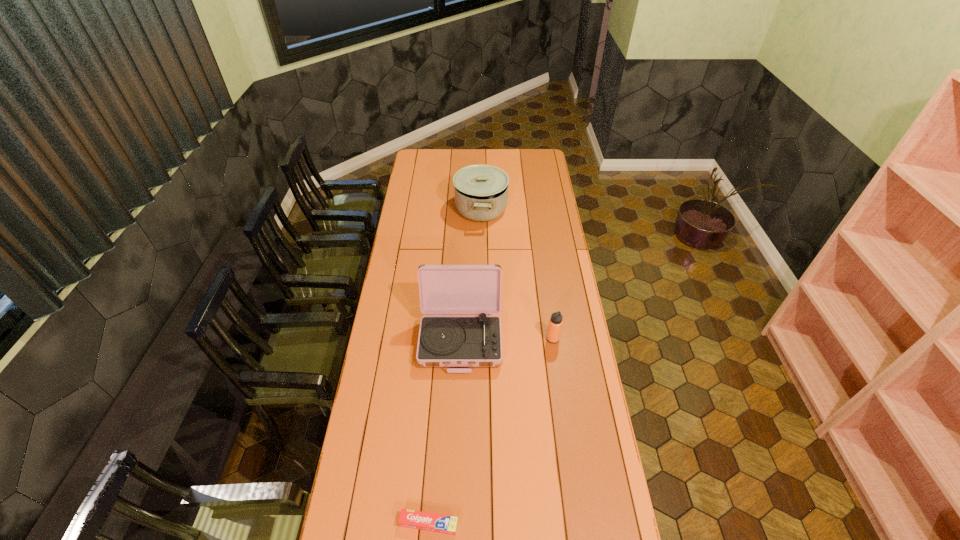
You are a GUI agent. You are given a task and a screenshot of the screen. Output one action in this format:
    pyautogui.click(x=<x>, y=<y>)
    Task: Click on the vacant space positioned on the right of the nearest object
    This screenshot has width=960, height=540.
    Given the screenshot: What is the action you would take?
    pyautogui.click(x=485, y=523)

In order to click on object that is at the right edge in this screenshot , I will do `click(555, 323)`.

Image resolution: width=960 pixels, height=540 pixels. I want to click on vacant space at the far edge of the desktop, so tap(487, 162).

This screenshot has height=540, width=960. I want to click on free space at the left edge, so point(368,412).

Where is `free location at the right edge of the desktop`? free location at the right edge of the desktop is located at coordinates (563, 314).

At what (x,y) coordinates should I click in order to perform the action: click on free region at the far left corner of the desktop. Please return your answer as a coordinate pair (x, y). The height and width of the screenshot is (540, 960). Looking at the image, I should click on (429, 149).

In the image, there is a desktop. Where is `free space at the far right corner`? The height and width of the screenshot is (540, 960). free space at the far right corner is located at coordinates (533, 159).

In order to click on blank region between the second shortest object and the toothpaste in this screenshot , I will do `click(491, 431)`.

Find the location of `unoccupied position between the farthest object and the third tallest object`. unoccupied position between the farthest object and the third tallest object is located at coordinates (516, 274).

You are a GUI agent. You are given a task and a screenshot of the screen. Output one action in this format:
    pyautogui.click(x=<x>, y=<y>)
    Task: Click on the free area in between the shortest object and the tallest object
    This screenshot has height=540, width=960.
    Given the screenshot: What is the action you would take?
    pyautogui.click(x=444, y=431)